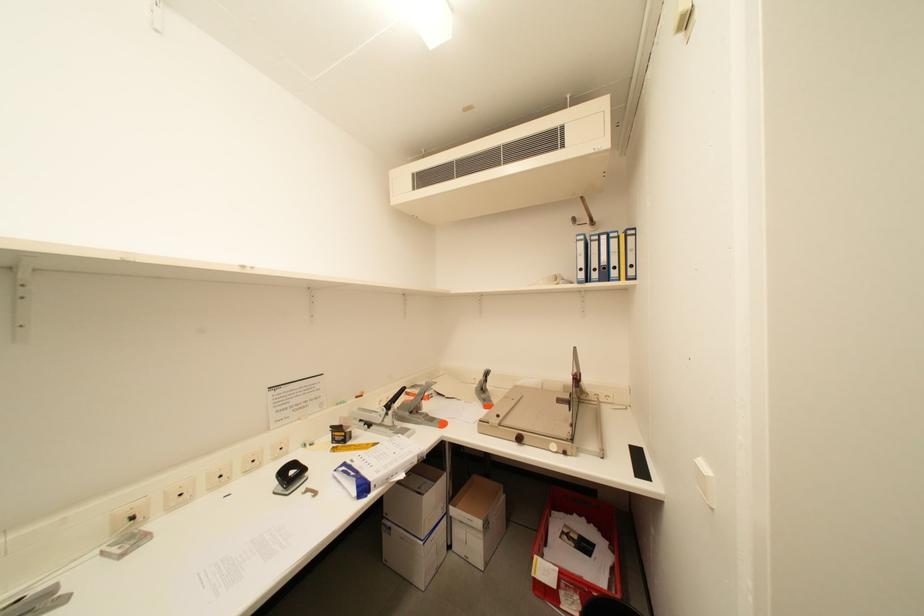
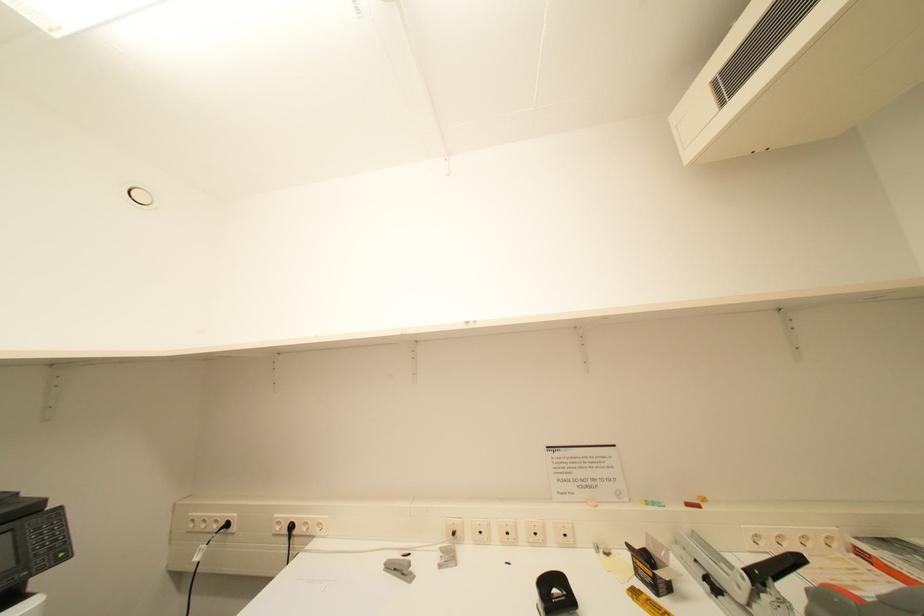
Question: The camera is either moving clockwise (left) or counter-clockwise (right) around the object. The first image is from the beginning of the video and the second image is from the end. Is the camera moving left or right when shooting the video?

Choices:
 (A) Left
 (B) Right

Answer: (B)